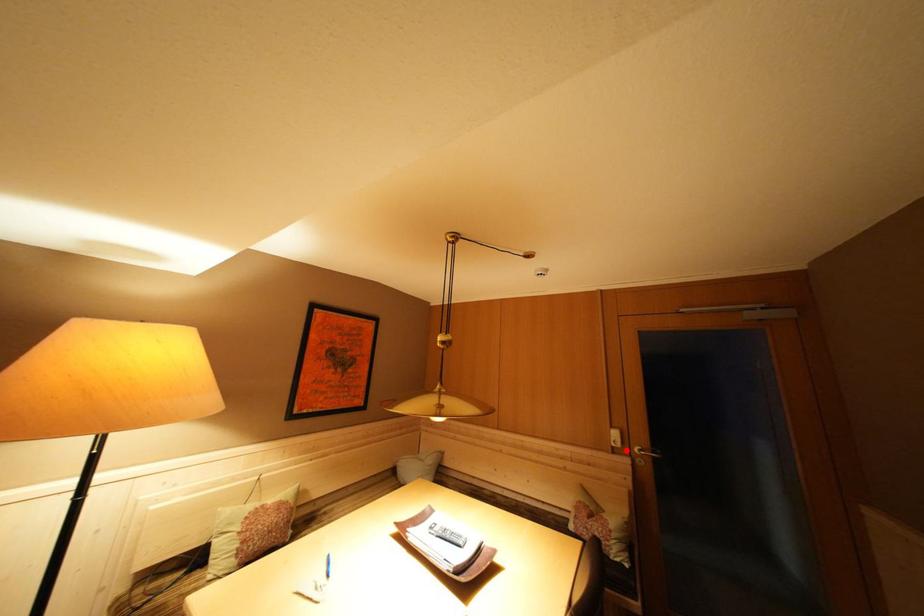
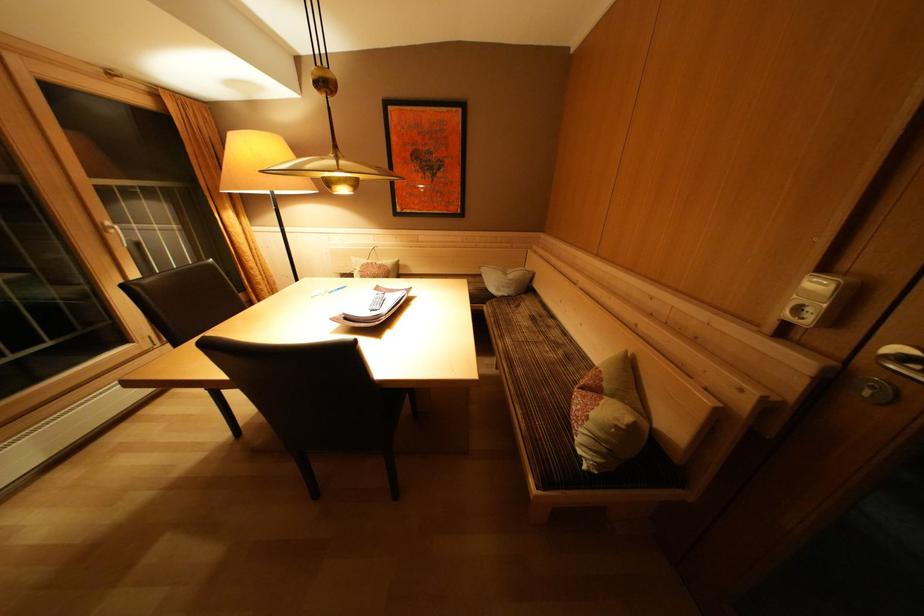
Question: I am providing you with two images of the same scene from different viewpoints. A red point is marked on the first image. Can you still see the location of the red point in image 2?

Choices:
 (A) Yes
 (B) No

Answer: (A)